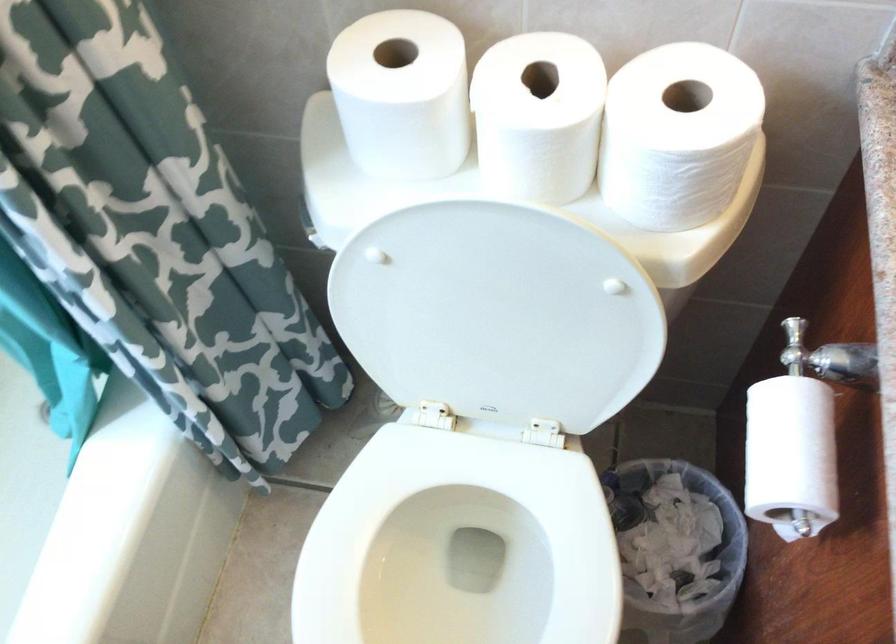
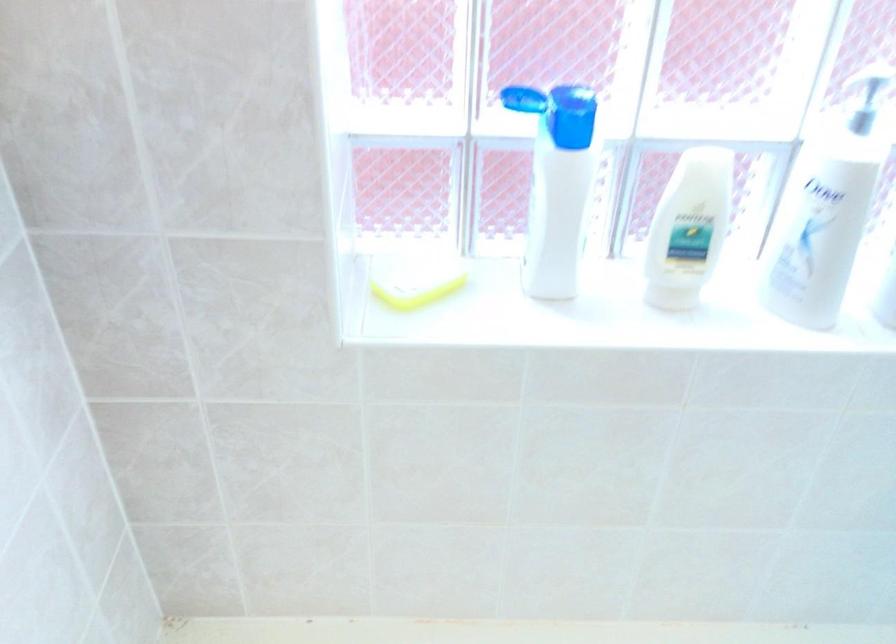
Question: The first image is from the beginning of the video and the second image is from the end. How did the camera likely rotate when shooting the video?

Choices:
 (A) Left
 (B) Right
 (C) Up
 (D) Down

Answer: (A)